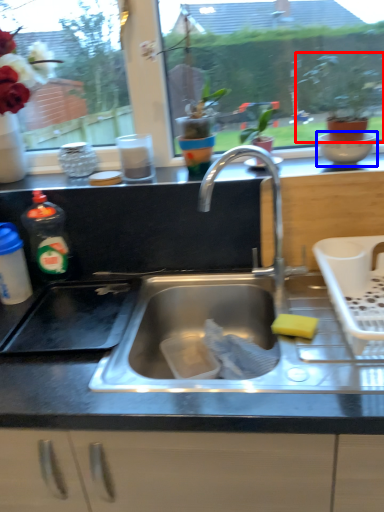
Question: Which object appears closest to the camera in this image, houseplant (highlighted by a red box) or mixing bowl (highlighted by a blue box)?

Choices:
 (A) houseplant
 (B) mixing bowl

Answer: (A)